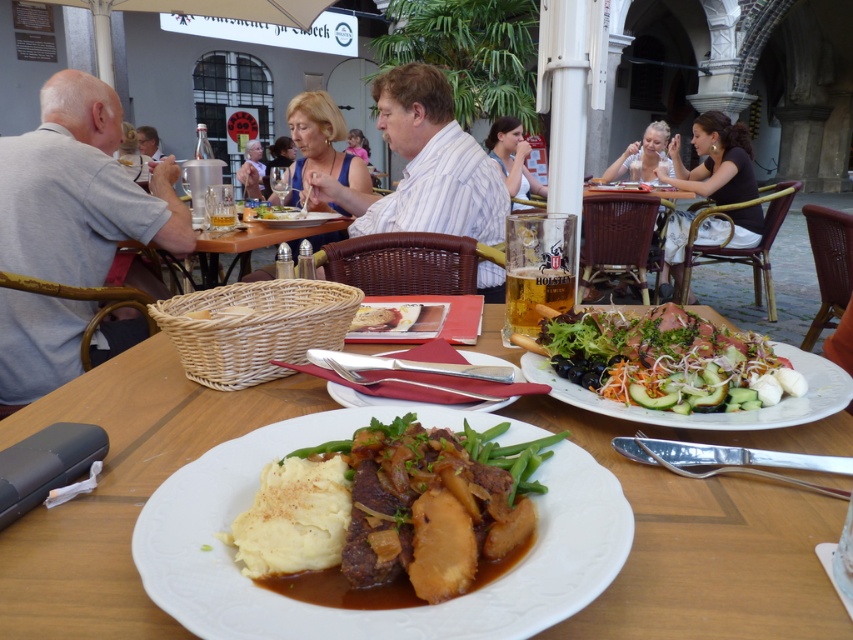
Is white ceramic plate at center above slightly browned bread at center?

Actually, white ceramic plate at center is below slightly browned bread at center.

Does white ceramic plate at center lie in front of slightly browned bread at center?

Yes, white ceramic plate at center is in front of slightly browned bread at center.

Locate an element on the screen. This screenshot has height=640, width=853. white ceramic plate at center is located at coordinates (711, 538).

Is point (515, 486) farther from camera compared to point (88, 314)?

No, it is not.

Who is positioned more to the left, white creamy mashed potatoes at center or gray cotton shirt at left?

From the viewer's perspective, gray cotton shirt at left appears more on the left side.

Where is `white creamy mashed potatoes at center`? white creamy mashed potatoes at center is located at coordinates (392, 509).

Is gray cotton shirt at left below fresh green salad at center?

No, gray cotton shirt at left is not below fresh green salad at center.

Can you confirm if gray cotton shirt at left is positioned to the right of fresh green salad at center?

In fact, gray cotton shirt at left is to the left of fresh green salad at center.

Is point (49, 256) positioned after point (704, 372)?

Yes, it is behind point (704, 372).

At what (x,y) coordinates should I click in order to perform the action: click on gray cotton shirt at left. Please return your answer as a coordinate pair (x, y). The width and height of the screenshot is (853, 640). Looking at the image, I should click on (79, 189).